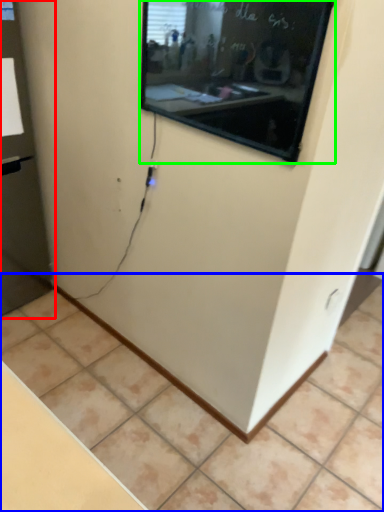
Question: Which object is the closest to the glass door (highlighted by a red box)? Choose among these: tile (highlighted by a blue box) or projection screen (highlighted by a green box).

Choices:
 (A) tile
 (B) projection screen

Answer: (A)